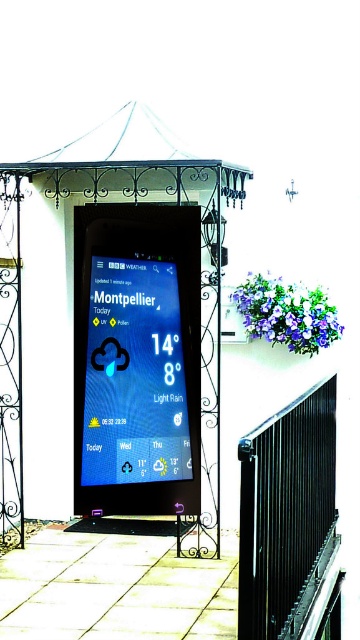
Is matte blue screen at center smaller than black wrought iron canopy at upper center?

Yes, matte blue screen at center is smaller than black wrought iron canopy at upper center.

Which is above, matte blue screen at center or black wrought iron canopy at upper center?

black wrought iron canopy at upper center is above.

This screenshot has height=640, width=360. What are the coordinates of `matte blue screen at center` in the screenshot? It's located at (135, 376).

Identify the location of matte blue screen at center. (135, 376).

In the scene shown: Can you confirm if matte blue screen at center is thinner than black metal/rail at lower right?

Indeed, matte blue screen at center has a lesser width compared to black metal/rail at lower right.

Who is more forward, (119, 465) or (294, 492)?

Positioned in front is point (294, 492).

You are a GUI agent. You are given a task and a screenshot of the screen. Output one action in this format:
    pyautogui.click(x=<x>, y=<y>)
    Task: Click on the matte blue screen at center
    
    Given the screenshot: What is the action you would take?
    pyautogui.click(x=135, y=376)

Which is behind, point (286, 470) or point (231, 186)?

Point (231, 186)

Is black metal/rail at lower right taller than black wrought iron canopy at upper center?

Indeed, black metal/rail at lower right has a greater height compared to black wrought iron canopy at upper center.

Locate an element on the screen. black metal/rail at lower right is located at coordinates (285, 515).

The height and width of the screenshot is (640, 360). In order to click on black metal/rail at lower right in this screenshot , I will do `click(285, 515)`.